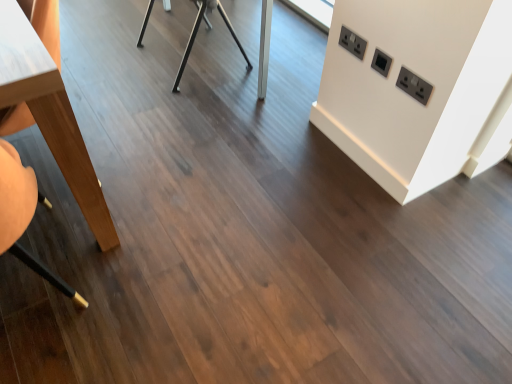
The width and height of the screenshot is (512, 384). I want to click on free space in front of metallic silver table at center, the first table viewed from the right, so click(190, 104).